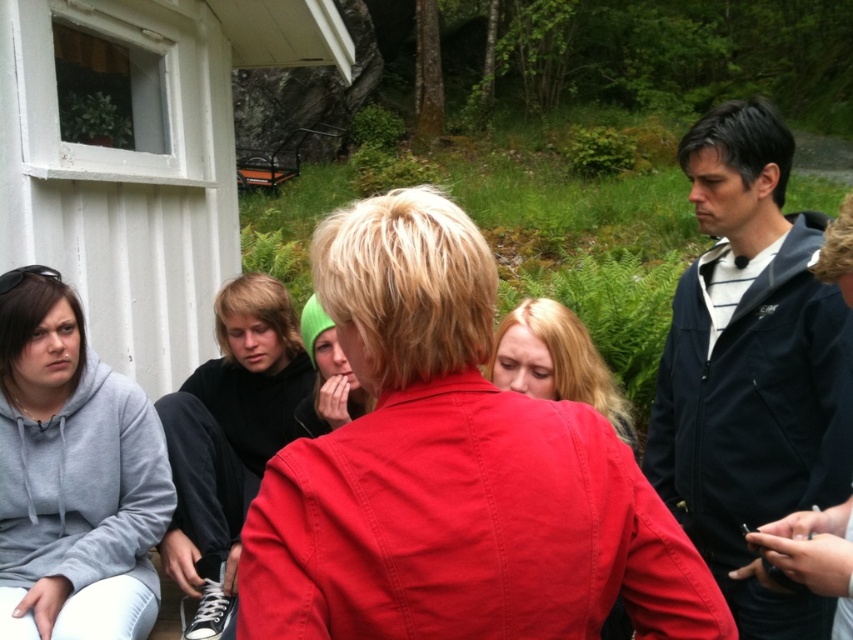
Who is higher up, black matte jacket at center or green knit hat at center?

green knit hat at center is higher up.

Image resolution: width=853 pixels, height=640 pixels. I want to click on black matte jacket at center, so click(x=225, y=444).

Is matte red jacket at center below black matte jacket at center?

No, matte red jacket at center is not below black matte jacket at center.

Between matte red jacket at center and black matte jacket at center, which one appears on the left side from the viewer's perspective?

From the viewer's perspective, black matte jacket at center appears more on the left side.

Is point (566, 436) less distant than point (231, 536)?

Yes.

Identify the location of matte red jacket at center. The width and height of the screenshot is (853, 640). (453, 472).

Who is taller, gray fleece sweatshirt at lower left or green knit hat at center?

gray fleece sweatshirt at lower left is taller.

Can you confirm if gray fleece sweatshirt at lower left is shorter than green knit hat at center?

No, gray fleece sweatshirt at lower left is not shorter than green knit hat at center.

Locate an element on the screen. The width and height of the screenshot is (853, 640). gray fleece sweatshirt at lower left is located at coordinates (71, 458).

The width and height of the screenshot is (853, 640). In order to click on gray fleece sweatshirt at lower left in this screenshot , I will do `click(71, 458)`.